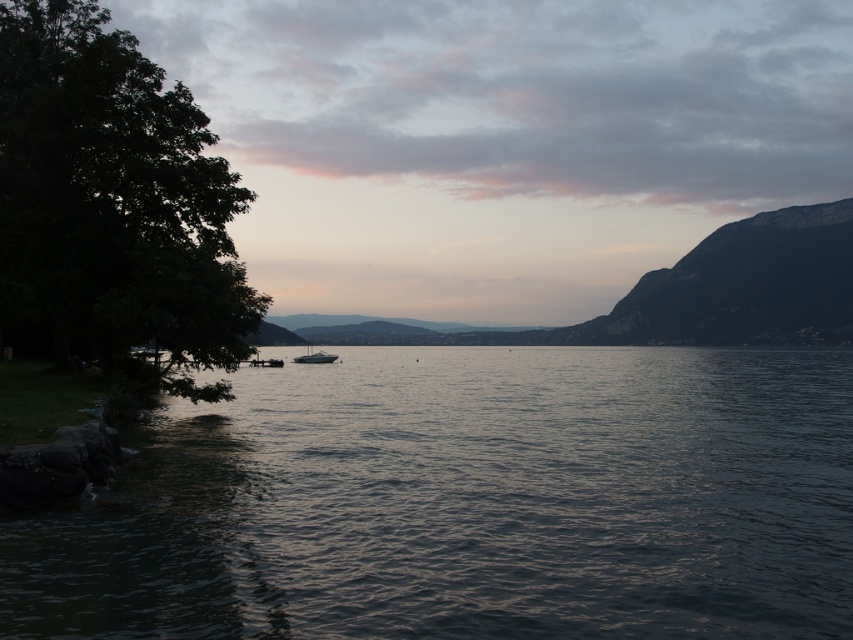
Question: Is dark water at center above shiny silver boat at center?

Choices:
 (A) no
 (B) yes

Answer: (A)

Question: Does dark water at center appear under shiny silver boat at center?

Choices:
 (A) no
 (B) yes

Answer: (B)

Question: Which of the following is the closest to the observer?

Choices:
 (A) (416, 396)
 (B) (80, 97)

Answer: (B)

Question: Is dark water at center bigger than dark green leafy tree at left?

Choices:
 (A) no
 (B) yes

Answer: (B)

Question: Which point appears farthest from the camera in this image?

Choices:
 (A) (129, 48)
 (B) (303, 362)
 (C) (413, 611)

Answer: (B)

Question: Among these points, which one is nearest to the camera?

Choices:
 (A) (76, 260)
 (B) (228, 550)
 (C) (318, 358)

Answer: (B)